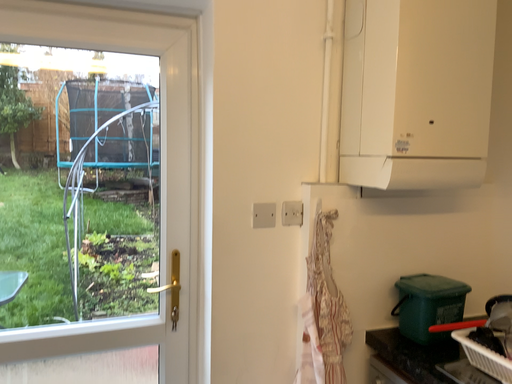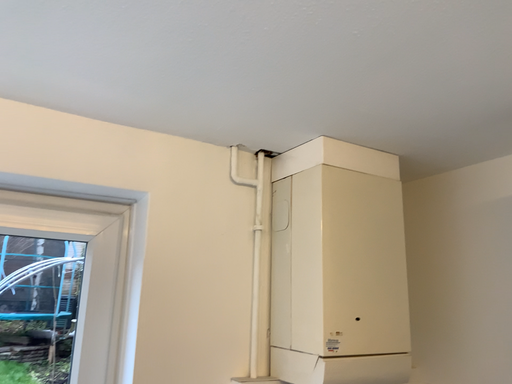
Question: How did the camera likely rotate when shooting the video?

Choices:
 (A) rotated upward
 (B) rotated downward

Answer: (A)